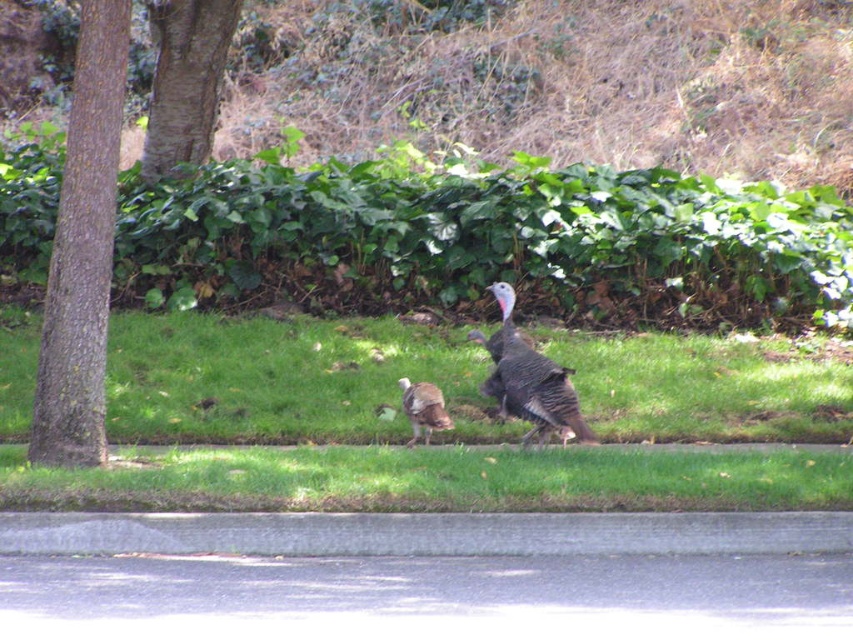
Question: Does brown rough bark tree at left appear under gray feathered turkey at center?

Choices:
 (A) no
 (B) yes

Answer: (A)

Question: Can you confirm if green grass at center is wider than brown rough bark tree at upper left?

Choices:
 (A) yes
 (B) no

Answer: (A)

Question: Which object is positioned farthest from the gray concrete curb at lower center?

Choices:
 (A) gray feathered turkey at center
 (B) green grass at center
 (C) green grass at lower center
 (D) brown rough bark tree at left

Answer: (B)

Question: Can you confirm if green grass at lower center is thinner than brown rough bark tree at left?

Choices:
 (A) yes
 (B) no

Answer: (B)

Question: Which of the following is the closest to the observer?

Choices:
 (A) (291, 416)
 (B) (518, 467)
 (C) (158, 65)

Answer: (B)

Question: Which point is farther to the camera?

Choices:
 (A) (401, 378)
 (B) (218, 468)
 (C) (496, 285)

Answer: (A)